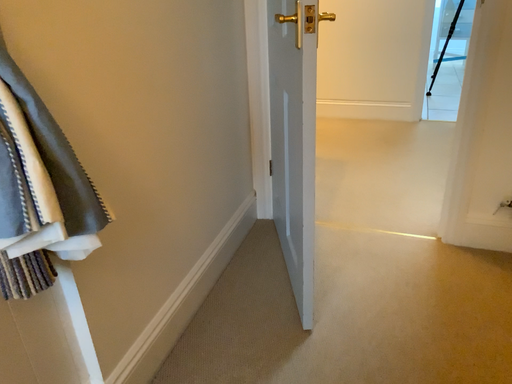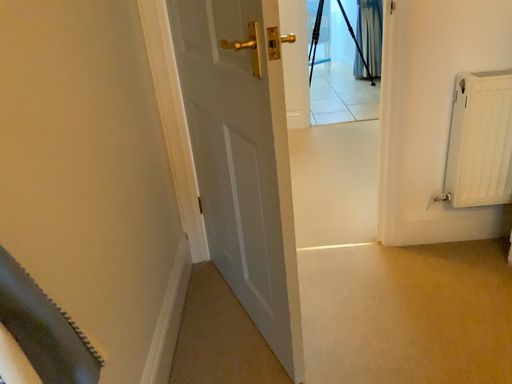
Question: How did the camera likely rotate when shooting the video?

Choices:
 (A) rotated right
 (B) rotated left

Answer: (A)